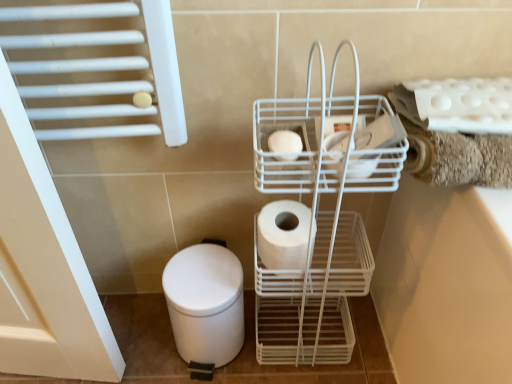
From the picture: Measure the distance between white matte toilet paper at center, the 1th toilet paper in the bottom-to-top sequence, and camera.

white matte toilet paper at center, the 1th toilet paper in the bottom-to-top sequence, is 30.28 inches from camera.

The width and height of the screenshot is (512, 384). What do you see at coordinates (285, 145) in the screenshot? I see `white matte toilet paper at center, the first toilet paper in the front-to-back sequence` at bounding box center [285, 145].

Locate an element on the screen. This screenshot has width=512, height=384. white wire trolley at center is located at coordinates (322, 218).

At what (x,y) coordinates should I click in order to perform the action: click on white matte bidet at lower left. Please return your answer as a coordinate pair (x, y). This screenshot has width=512, height=384. Looking at the image, I should click on (205, 303).

From a real-world perspective, is white matte toilet paper at center, which ranks as the second toilet paper in back-to-front order, positioned above or below white matte bidet at lower left?

From a real-world perspective, white matte toilet paper at center, which ranks as the second toilet paper in back-to-front order, is physically above white matte bidet at lower left.

Which is in front, point (282, 150) or point (241, 281)?

Positioned in front is point (282, 150).

Is white matte toilet paper at center, the 1th toilet paper viewed from the top, taller than white matte bidet at lower left?

In fact, white matte toilet paper at center, the 1th toilet paper viewed from the top, may be shorter than white matte bidet at lower left.

In the scene shown: Is white matte toilet paper at center, the first toilet paper in the front-to-back sequence, smaller than white matte bidet at lower left?

Yes, white matte toilet paper at center, the first toilet paper in the front-to-back sequence, is smaller than white matte bidet at lower left.

Are white matte bidet at lower left and white matte toilet paper at center, which is the 2th toilet paper in bottom-to-top order, far apart?

white matte bidet at lower left is near white matte toilet paper at center, which is the 2th toilet paper in bottom-to-top order, not far away.

Between white matte bidet at lower left and white matte toilet paper at center, which is the 2th toilet paper in bottom-to-top order, which one has more height?

Standing taller between the two is white matte bidet at lower left.

How many degrees apart are the facing directions of white matte bidet at lower left and white matte toilet paper at center, which is the 2th toilet paper in bottom-to-top order?

The facing directions of white matte bidet at lower left and white matte toilet paper at center, which is the 2th toilet paper in bottom-to-top order, are 0.517 degrees apart.

Considering the positions of point (186, 275) and point (278, 157), is point (186, 275) closer or farther from the camera than point (278, 157)?

Point (186, 275) is positioned farther from the camera compared to point (278, 157).

Considering the points (286, 142) and (272, 254), which point is behind, point (286, 142) or point (272, 254)?

The point (272, 254) is behind.

Can you confirm if white matte toilet paper at center, the 1th toilet paper viewed from the top, is wider than white matte toilet paper at center, the 1th toilet paper in the bottom-to-top sequence?

Incorrect, the width of white matte toilet paper at center, the 1th toilet paper viewed from the top, does not surpass that of white matte toilet paper at center, the 1th toilet paper in the bottom-to-top sequence.

Is white matte toilet paper at center, the first toilet paper in the front-to-back sequence, oriented towards white matte toilet paper at center, which is counted as the 2th toilet paper, starting from the front?

No, white matte toilet paper at center, the first toilet paper in the front-to-back sequence, is not facing towards white matte toilet paper at center, which is counted as the 2th toilet paper, starting from the front.

From the picture: From the image's perspective, between white matte toilet paper at center, which is the 2th toilet paper in bottom-to-top order, and white matte toilet paper at center, the 1th toilet paper in the bottom-to-top sequence, which one is located above?

white matte toilet paper at center, which is the 2th toilet paper in bottom-to-top order, from the image's perspective.

Considering the relative sizes of white matte bidet at lower left and white matte toilet paper at center, which is counted as the 2th toilet paper, starting from the front, in the image provided, is white matte bidet at lower left wider than white matte toilet paper at center, which is counted as the 2th toilet paper, starting from the front,?

→ Yes, white matte bidet at lower left is wider than white matte toilet paper at center, which is counted as the 2th toilet paper, starting from the front.

Which of these two, white matte bidet at lower left or white matte toilet paper at center, the 1th toilet paper in the bottom-to-top sequence, stands shorter?

Standing shorter between the two is white matte toilet paper at center, the 1th toilet paper in the bottom-to-top sequence.

Is white matte bidet at lower left looking in the opposite direction of white matte toilet paper at center, arranged as the 2th toilet paper when viewed from the top?

No, white matte bidet at lower left's orientation is not away from white matte toilet paper at center, arranged as the 2th toilet paper when viewed from the top.

Looking at this image, how distant is white matte bidet at lower left from white matte toilet paper at center, which is the 1th toilet paper in back-to-front order?

They are 7.85 inches apart.

From a real-world perspective, is white wire trolley at center positioned under white matte toilet paper at center, which is the 2th toilet paper in bottom-to-top order, based on gravity?

Correct, in the physical world, white wire trolley at center is lower than white matte toilet paper at center, which is the 2th toilet paper in bottom-to-top order.

In the scene shown: In the image, is white wire trolley at center positioned in front of or behind white matte toilet paper at center, which is the 2th toilet paper in bottom-to-top order?

white wire trolley at center is in front of white matte toilet paper at center, which is the 2th toilet paper in bottom-to-top order.

Is white wire trolley at center located outside white matte toilet paper at center, which is the 2th toilet paper in bottom-to-top order?

Yes, white wire trolley at center is located beyond the bounds of white matte toilet paper at center, which is the 2th toilet paper in bottom-to-top order.

From the image's perspective, is white wire trolley at center above white matte toilet paper at center, which ranks as the second toilet paper in back-to-front order?

No, from the image's perspective, white wire trolley at center is not over white matte toilet paper at center, which ranks as the second toilet paper in back-to-front order.

From the image's perspective, is white matte toilet paper at center, which is the 1th toilet paper in back-to-front order, above white matte bidet at lower left?

Yes, from the image's perspective, white matte toilet paper at center, which is the 1th toilet paper in back-to-front order, is on top of white matte bidet at lower left.

Can you confirm if white matte toilet paper at center, arranged as the 2th toilet paper when viewed from the top, is bigger than white matte bidet at lower left?

Actually, white matte toilet paper at center, arranged as the 2th toilet paper when viewed from the top, might be smaller than white matte bidet at lower left.

This screenshot has width=512, height=384. I want to click on the 1st toilet paper above the white matte bidet at lower left (from a real-world perspective), so click(x=283, y=235).

Which is behind, white matte toilet paper at center, which is the 1th toilet paper in back-to-front order, or white matte bidet at lower left?

white matte bidet at lower left.

Considering the points (226, 294) and (334, 140), which point is in front, point (226, 294) or point (334, 140)?

Positioned in front is point (334, 140).

Is white matte bidet at lower left facing away from white wire trolley at center?

No, white matte bidet at lower left is not facing the opposite direction of white wire trolley at center.

Where is `trolley above the white matte bidet at lower left (from a real-world perspective)`? The image size is (512, 384). trolley above the white matte bidet at lower left (from a real-world perspective) is located at coordinates (322, 218).

Is white matte bidet at lower left far away from white wire trolley at center?

No, white matte bidet at lower left is in close proximity to white wire trolley at center.

Locate an element on the screen. This screenshot has height=384, width=512. bidet that appears below the white matte toilet paper at center, which ranks as the second toilet paper in back-to-front order (from the image's perspective) is located at coordinates (205, 303).

Locate an element on the screen. This screenshot has width=512, height=384. bidet below the white matte toilet paper at center, which is the 2th toilet paper in bottom-to-top order (from a real-world perspective) is located at coordinates (205, 303).

Looking at the image, which one is located closer to white matte toilet paper at center, the 1th toilet paper in the bottom-to-top sequence, white wire trolley at center or white matte bidet at lower left?

The object closer to white matte toilet paper at center, the 1th toilet paper in the bottom-to-top sequence, is white wire trolley at center.

From the image, which object appears to be farther from white matte toilet paper at center, which is counted as the 2th toilet paper, starting from the front, white matte bidet at lower left or white wire trolley at center?

Among the two, white matte bidet at lower left is located further to white matte toilet paper at center, which is counted as the 2th toilet paper, starting from the front.

Based on the photo, when comparing their distances from white matte bidet at lower left, does white matte toilet paper at center, which is counted as the 2th toilet paper, starting from the front, or white matte toilet paper at center, which ranks as the second toilet paper in back-to-front order, seem closer?

Based on the image, white matte toilet paper at center, which is counted as the 2th toilet paper, starting from the front, appears to be nearer to white matte bidet at lower left.

From the image, which object appears to be farther from white wire trolley at center, white matte toilet paper at center, which ranks as the second toilet paper in back-to-front order, or white matte bidet at lower left?

white matte toilet paper at center, which ranks as the second toilet paper in back-to-front order, lies further to white wire trolley at center than the other object.

When comparing their distances from white matte toilet paper at center, the first toilet paper in the front-to-back sequence, does white matte bidet at lower left or white matte toilet paper at center, which is counted as the 2th toilet paper, starting from the front, seem further?

white matte bidet at lower left is further to white matte toilet paper at center, the first toilet paper in the front-to-back sequence.

Which object lies nearer to the anchor point white wire trolley at center, white matte toilet paper at center, which is the 2th toilet paper in bottom-to-top order, or white matte toilet paper at center, arranged as the 2th toilet paper when viewed from the top?

white matte toilet paper at center, arranged as the 2th toilet paper when viewed from the top.

Based on their spatial positions, is white wire trolley at center or white matte toilet paper at center, the 1th toilet paper viewed from the top, further from white matte toilet paper at center, the 1th toilet paper in the bottom-to-top sequence?

white matte toilet paper at center, the 1th toilet paper viewed from the top.

From the picture: Based on their spatial positions, is white wire trolley at center or white matte toilet paper at center, arranged as the 2th toilet paper when viewed from the top, closer to white matte bidet at lower left?

Based on the image, white matte toilet paper at center, arranged as the 2th toilet paper when viewed from the top, appears to be nearer to white matte bidet at lower left.

I want to click on toilet paper positioned between white wire trolley at center and white matte toilet paper at center, which is the 1th toilet paper in back-to-front order, from near to far, so click(285, 145).

I want to click on toilet paper between white matte toilet paper at center, the first toilet paper in the front-to-back sequence, and white matte bidet at lower left vertically, so click(x=283, y=235).

Where is `trolley between white matte toilet paper at center, the first toilet paper in the front-to-back sequence, and white matte bidet at lower left, in the vertical direction`? The width and height of the screenshot is (512, 384). trolley between white matte toilet paper at center, the first toilet paper in the front-to-back sequence, and white matte bidet at lower left, in the vertical direction is located at coordinates (322, 218).